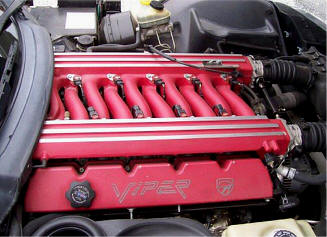
This screenshot has height=237, width=327. Find the location of `light`. light is located at coordinates 84,22.